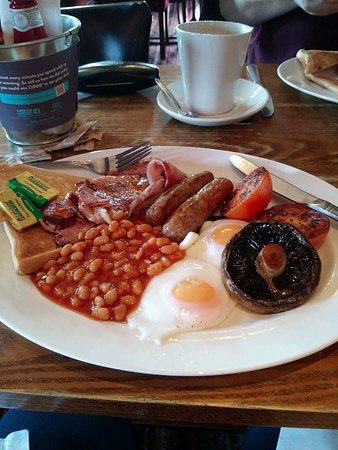
What are the coordinates of `silver fork` in the screenshot? It's located at (98, 162).